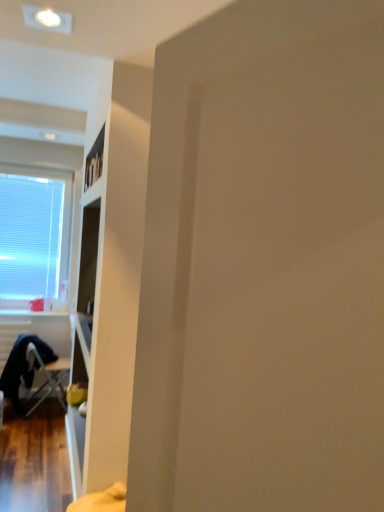
Question: Can you confirm if metallic silver folding chair at lower left is wider than white blinds at left?

Choices:
 (A) no
 (B) yes

Answer: (B)

Question: Considering the relative sizes of metallic silver folding chair at lower left and white blinds at left in the image provided, is metallic silver folding chair at lower left shorter than white blinds at left?

Choices:
 (A) yes
 (B) no

Answer: (A)

Question: Is white blinds at left surrounded by metallic silver folding chair at lower left?

Choices:
 (A) yes
 (B) no

Answer: (B)

Question: From the image's perspective, does metallic silver folding chair at lower left appear lower than white blinds at left?

Choices:
 (A) yes
 (B) no

Answer: (A)

Question: Considering the relative sizes of metallic silver folding chair at lower left and white blinds at left in the image provided, is metallic silver folding chair at lower left thinner than white blinds at left?

Choices:
 (A) yes
 (B) no

Answer: (B)

Question: Does metallic silver folding chair at lower left turn towards white blinds at left?

Choices:
 (A) yes
 (B) no

Answer: (B)

Question: Is white blinds at left surrounding metallic silver folding chair at lower left?

Choices:
 (A) no
 (B) yes

Answer: (A)

Question: From the image's perspective, is white blinds at left on top of metallic silver folding chair at lower left?

Choices:
 (A) yes
 (B) no

Answer: (A)

Question: Can you confirm if white blinds at left is taller than metallic silver folding chair at lower left?

Choices:
 (A) yes
 (B) no

Answer: (A)

Question: Can you confirm if white blinds at left is thinner than metallic silver folding chair at lower left?

Choices:
 (A) no
 (B) yes

Answer: (B)

Question: Can you confirm if white blinds at left is positioned to the left of metallic silver folding chair at lower left?

Choices:
 (A) yes
 (B) no

Answer: (A)

Question: Can you confirm if white blinds at left is shorter than metallic silver folding chair at lower left?

Choices:
 (A) no
 (B) yes

Answer: (A)

Question: In terms of size, does metallic silver folding chair at lower left appear bigger or smaller than white blinds at left?

Choices:
 (A) small
 (B) big

Answer: (B)